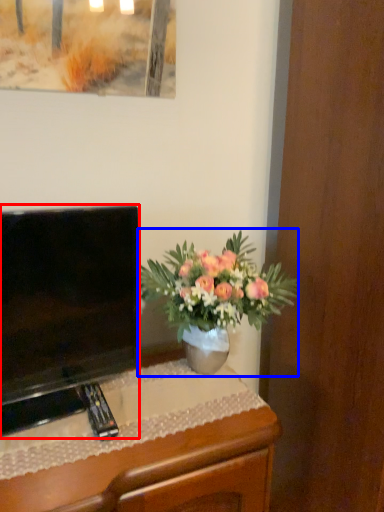
Question: Among these objects, which one is nearest to the camera, television (highlighted by a red box) or houseplant (highlighted by a blue box)?

Choices:
 (A) television
 (B) houseplant

Answer: (A)